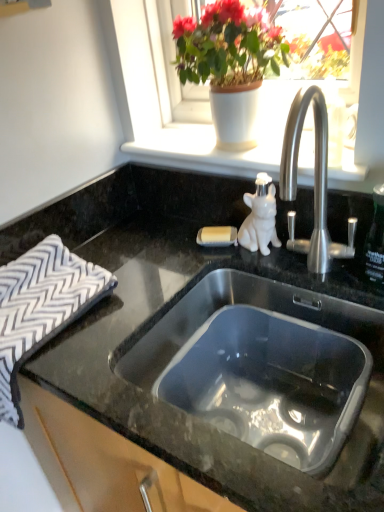
Question: Considering the relative sizes of matte white pot at upper center and stainless steel sink at center in the image provided, is matte white pot at upper center taller than stainless steel sink at center?

Choices:
 (A) no
 (B) yes

Answer: (B)

Question: Is matte white pot at upper center to the right of stainless steel sink at center from the viewer's perspective?

Choices:
 (A) yes
 (B) no

Answer: (B)

Question: Can you confirm if matte white pot at upper center is positioned to the left of stainless steel sink at center?

Choices:
 (A) no
 (B) yes

Answer: (B)

Question: Is the position of matte white pot at upper center more distant than that of stainless steel sink at center?

Choices:
 (A) no
 (B) yes

Answer: (B)

Question: Is matte white pot at upper center next to stainless steel sink at center?

Choices:
 (A) no
 (B) yes

Answer: (A)

Question: Is matte white pot at upper center outside stainless steel sink at center?

Choices:
 (A) no
 (B) yes

Answer: (B)

Question: Is white matte window sill at upper center closer to camera compared to white zigzag-patterned cloth at left?

Choices:
 (A) yes
 (B) no

Answer: (B)

Question: Is white matte window sill at upper center wider than white zigzag-patterned cloth at left?

Choices:
 (A) no
 (B) yes

Answer: (A)

Question: Can you confirm if white matte window sill at upper center is shorter than white zigzag-patterned cloth at left?

Choices:
 (A) no
 (B) yes

Answer: (B)

Question: Is white zigzag-patterned cloth at left at the back of white matte window sill at upper center?

Choices:
 (A) no
 (B) yes

Answer: (A)

Question: From the image's perspective, is white matte window sill at upper center on top of white zigzag-patterned cloth at left?

Choices:
 (A) no
 (B) yes

Answer: (B)

Question: Is white matte window sill at upper center further to the viewer compared to white zigzag-patterned cloth at left?

Choices:
 (A) yes
 (B) no

Answer: (A)

Question: Is matte white pot at upper center wider than white zigzag-patterned cloth at left?

Choices:
 (A) yes
 (B) no

Answer: (B)